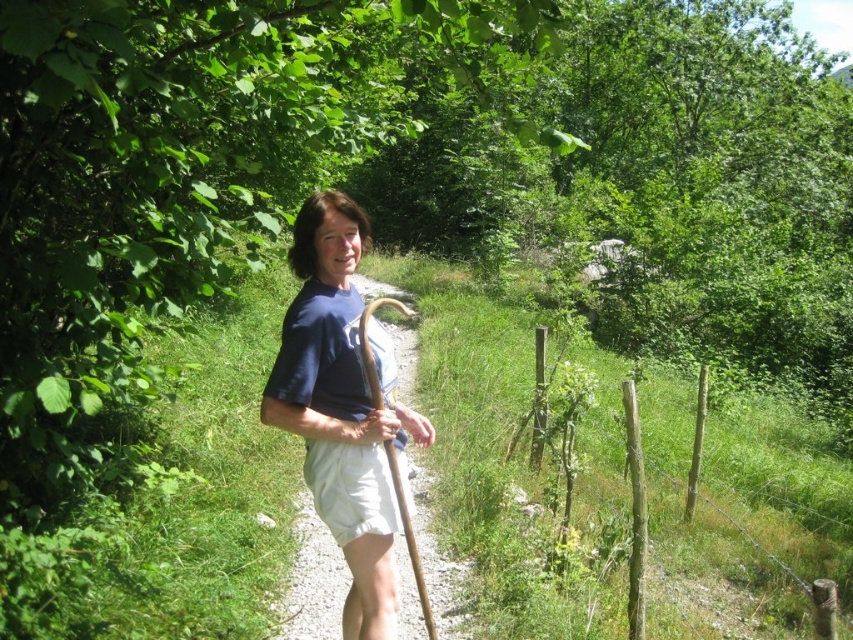
Question: Does blue cotton shirt at center appear on the right side of white cotton shorts at center?

Choices:
 (A) no
 (B) yes

Answer: (A)

Question: Which point is farther from the camera taking this photo?

Choices:
 (A) (351, 262)
 (B) (544, 340)
 (C) (305, 467)

Answer: (B)

Question: Which object is closer to the camera taking this photo?

Choices:
 (A) blue cotton shirt at center
 (B) white cotton shorts at center
 (C) wooden post at right

Answer: (A)

Question: Does blue cotton shirt at center have a greater width compared to wooden post at right?

Choices:
 (A) no
 (B) yes

Answer: (B)

Question: Considering the relative positions of wooden post at right and white cotton shorts at center in the image provided, where is wooden post at right located with respect to white cotton shorts at center?

Choices:
 (A) right
 (B) left

Answer: (A)

Question: Which object is farther from the camera taking this photo?

Choices:
 (A) blue cotton shirt at center
 (B) white cotton shorts at center
 (C) wooden post at right

Answer: (C)